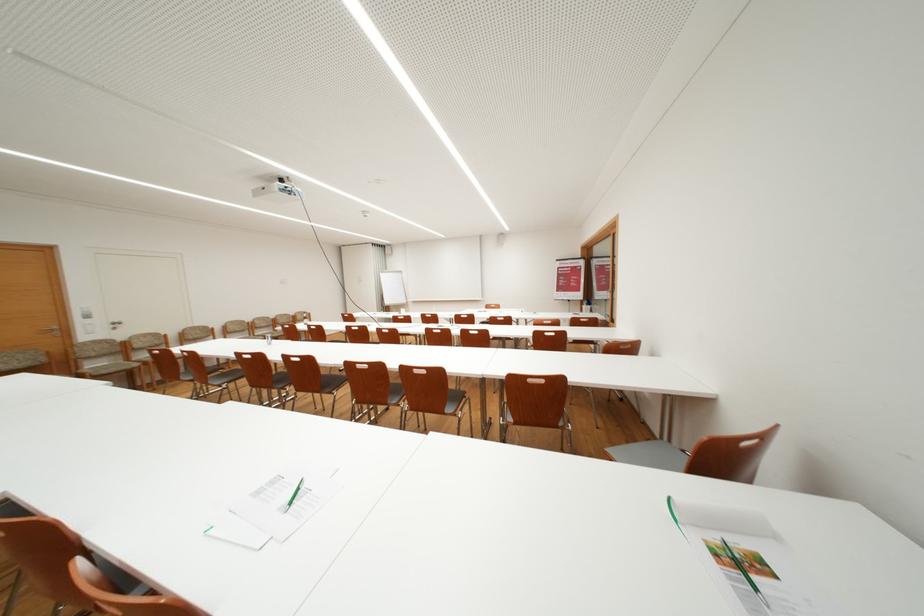
Describe the element at coordinates (52, 331) in the screenshot. The width and height of the screenshot is (924, 616). I see `a silver door handle` at that location.